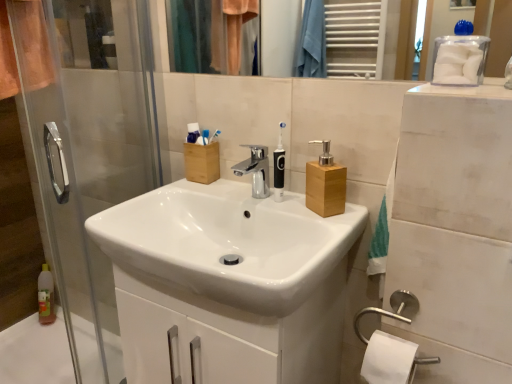
Find the location of a particular element. free spot above clear plastic bottle at lower left (from a real-world perspective) is located at coordinates (40, 349).